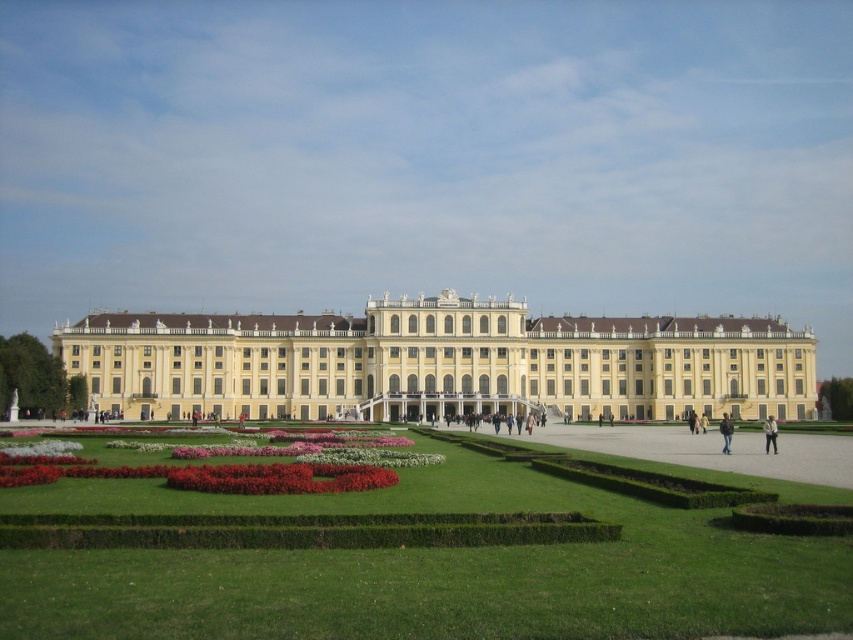
You are standing in the garden of the palace and want to walk from the green grass at center to the white cotton shirt at center. Is there enough space between them for you to pass through comfortably?

The green grass at center might be wider than the white cotton shirt at center, so there might be enough space to pass through comfortably. However, since the exact width isn t specified, it s advisable to check the distance before proceeding.

You are standing in front of the palace and see the green grass at center and the white cotton shirt at center. Which object is closer to you?

The green grass at center is closer to the viewer than the white cotton shirt at center.

You are standing in the garden in front of the palace. You notice two points marked in the scene. The first point is at coordinates point (x=364, y=321) and the second is at point (x=45, y=401). From your current position, which point is closer to you?

Point (x=45, y=401) is closer to you because it is in front of point (x=364, y=321).